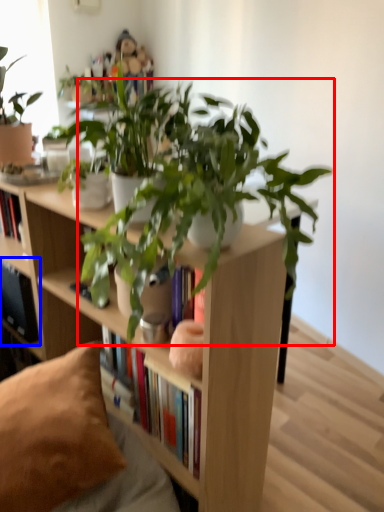
Question: Which object appears closest to the camera in this image, houseplant (highlighted by a red box) or shelf (highlighted by a blue box)?

Choices:
 (A) houseplant
 (B) shelf

Answer: (A)